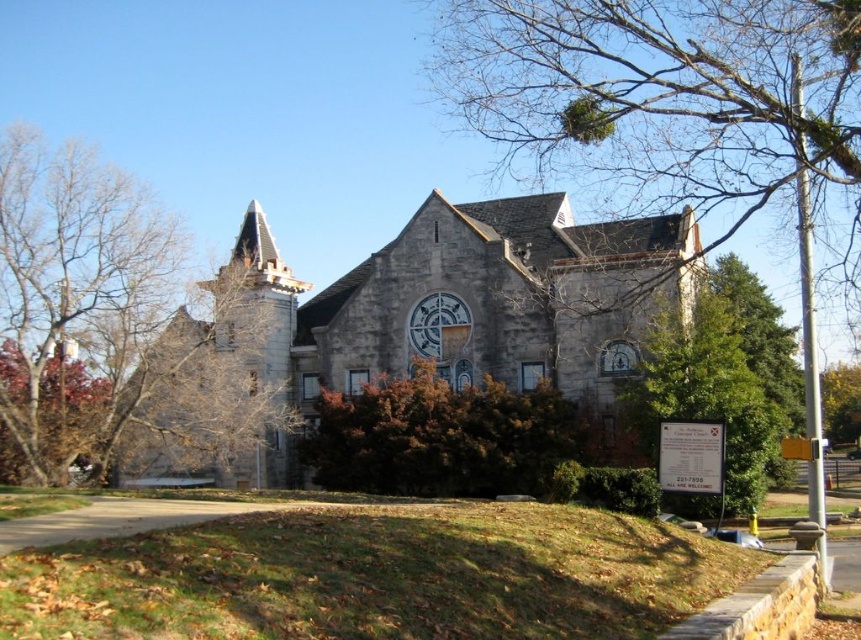
Based on the photo, which is more to the left, gray stone church at center or brown textured stone tower at upper left?

From the viewer's perspective, brown textured stone tower at upper left appears more on the left side.

Between point (135, 456) and point (180, 468), which one is positioned behind?

Positioned behind is point (180, 468).

At what (x,y) coordinates should I click in order to perform the action: click on gray stone church at center. Please return your answer as a coordinate pair (x, y). The width and height of the screenshot is (861, 640). Looking at the image, I should click on (468, 298).

The height and width of the screenshot is (640, 861). What are the coordinates of `gray stone church at center` in the screenshot? It's located at (468, 298).

Does brown textured stone tower at upper left come in front of stone clock at center?

That is True.

Who is higher up, brown textured stone tower at upper left or stone clock at center?

Positioned higher is brown textured stone tower at upper left.

What do you see at coordinates (121, 330) in the screenshot? The image size is (861, 640). I see `brown textured stone tower at upper left` at bounding box center [121, 330].

You are a GUI agent. You are given a task and a screenshot of the screen. Output one action in this format:
    pyautogui.click(x=<x>, y=<y>)
    Task: Click on the brown textured stone tower at upper left
    This screenshot has height=640, width=861.
    Given the screenshot: What is the action you would take?
    pyautogui.click(x=121, y=330)

Looking at this image, does green leafy tree at right appear under green leafy tree at center right?

No.

Locate an element on the screen. The image size is (861, 640). green leafy tree at right is located at coordinates 711,390.

Does point (713, 330) come behind point (853, 369)?

No, (713, 330) is closer to viewer.

You are a GUI agent. You are given a task and a screenshot of the screen. Output one action in this format:
    pyautogui.click(x=<x>, y=<y>)
    Task: Click on the green leafy tree at right
    
    Given the screenshot: What is the action you would take?
    pyautogui.click(x=711, y=390)